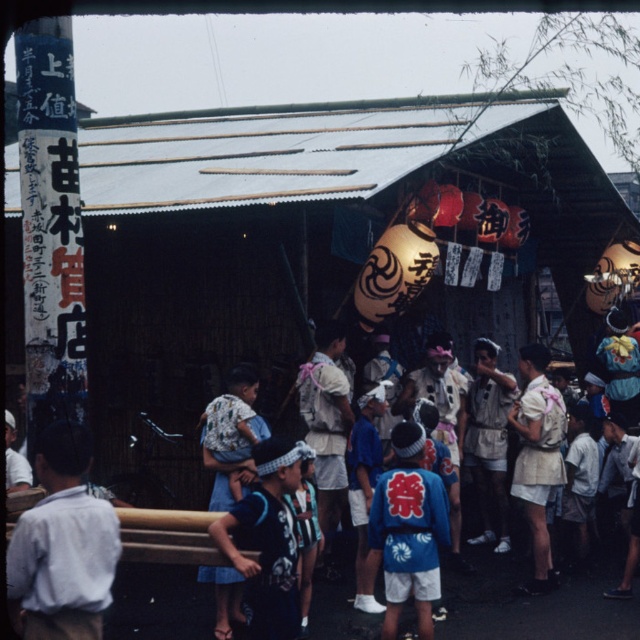
Question: Does wooden hut at center have a greater width compared to blue fabric kimono at center?

Choices:
 (A) yes
 (B) no

Answer: (A)

Question: Which point is closer to the camera?

Choices:
 (A) (92, 556)
 (B) (228, 182)
 (C) (420, 467)

Answer: (A)

Question: Which of the following is the closest to the observer?

Choices:
 (A) wooden hut at center
 (B) white cotton shirt at left
 (C) blue fabric kimono at center

Answer: (B)

Question: Which object is the farthest from the wooden hut at center?

Choices:
 (A) white cotton shirt at left
 (B) blue fabric kimono at center

Answer: (A)

Question: Can you confirm if wooden hut at center is wider than white cotton shirt at left?

Choices:
 (A) no
 (B) yes

Answer: (B)

Question: Can you confirm if wooden hut at center is wider than blue fabric kimono at center?

Choices:
 (A) yes
 (B) no

Answer: (A)